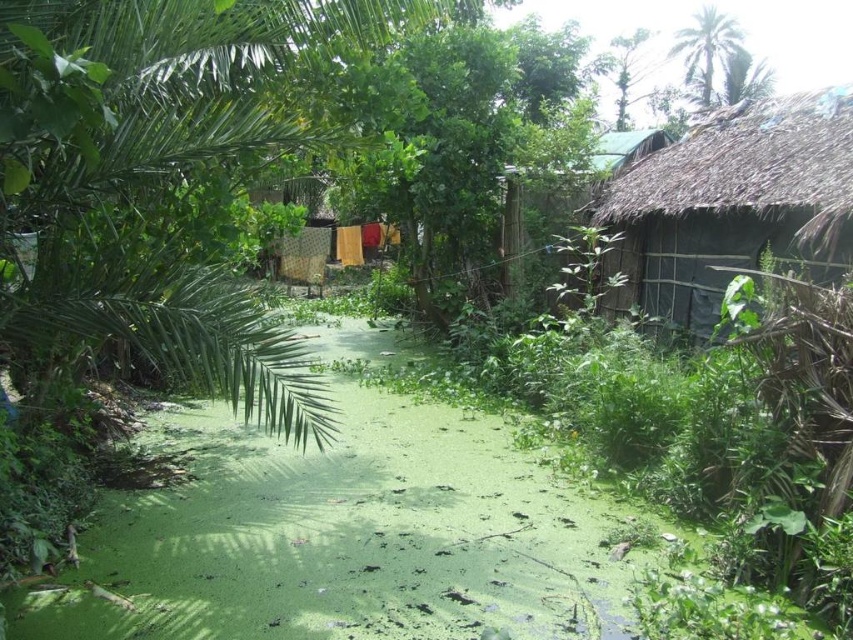
You are standing in the scene and want to take a photo of both point (795, 211) and point (589, 198). Which point should you focus on first to ensure both are in clear view?

You should focus on point (795, 211) first because it is closer to the camera than point (589, 198), ensuring both are in focus when using depth of field.

You are planning to build a small garden shed in your backyard and want to ensure it fits within the available space. You have two options for the shed design based on the image provided. The first design is inspired by the thatched roof hut at right, and the second by the green thatched hut at upper right. If the space you have can only accommodate the wider of the two, which design should you choose?

The thatched roof hut at right is wider than the green thatched hut at upper right, so you should choose the design based on the thatched roof hut at right to fit the available space.